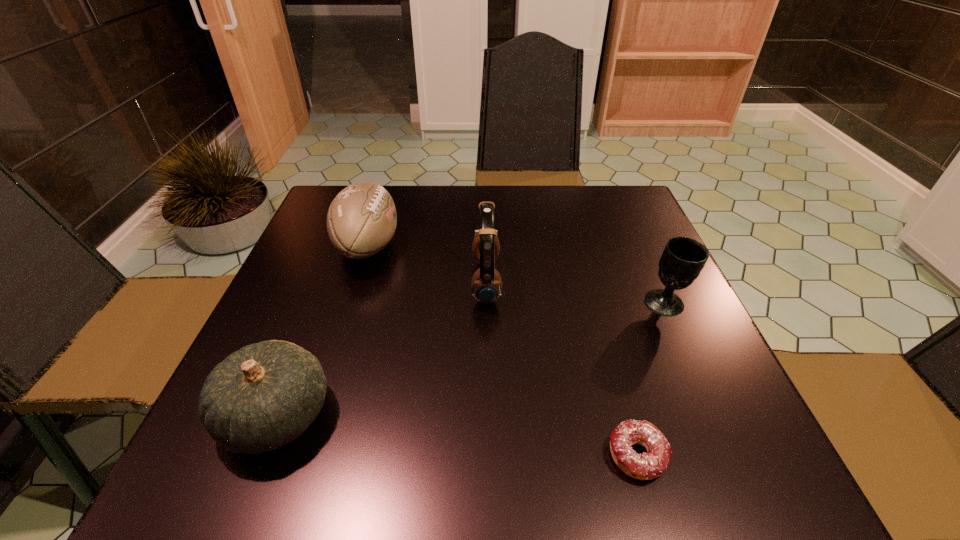
Find the location of `vacant space situated 0.380m on the laces of the football (American)`. vacant space situated 0.380m on the laces of the football (American) is located at coordinates (554, 246).

Locate an element on the screen. This screenshot has width=960, height=540. blank area located 0.210m on the back of the chalice is located at coordinates (x=634, y=234).

What are the coordinates of `free space located on the back of the gourd` in the screenshot? It's located at (336, 264).

Locate an element on the screen. This screenshot has height=540, width=960. free region located 0.090m on the right of the second object from right to left is located at coordinates (725, 456).

Find the location of a particular element. The image size is (960, 540). object situated at the far edge is located at coordinates (361, 220).

Locate an element on the screen. The height and width of the screenshot is (540, 960). gourd located in the near edge section of the desktop is located at coordinates 265,395.

Locate an element on the screen. Image resolution: width=960 pixels, height=540 pixels. doughnut located in the near edge section of the desktop is located at coordinates (645, 466).

Locate an element on the screen. football (American) that is at the left edge is located at coordinates (361, 220).

I want to click on gourd that is at the left edge, so click(x=265, y=395).

Where is `chalice present at the right edge`? chalice present at the right edge is located at coordinates (682, 260).